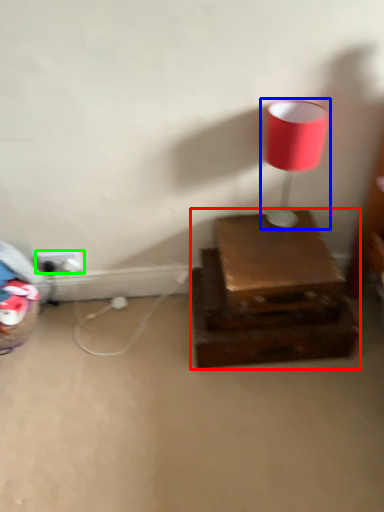
Question: Based on their relative distances, which object is farther from furniture (highlighted by a red box)? Choose from lamp (highlighted by a blue box) and electric outlet (highlighted by a green box).

Choices:
 (A) lamp
 (B) electric outlet

Answer: (B)